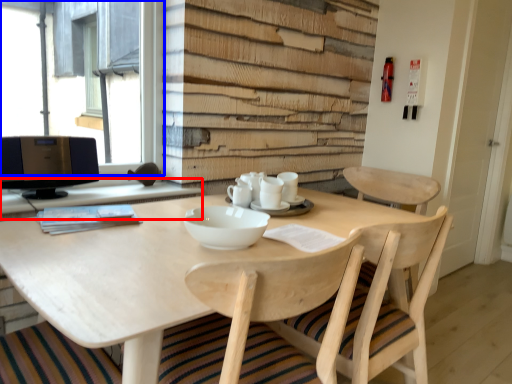
Question: Which point is further to the camera, computer desk (highlighted by a red box) or window (highlighted by a blue box)?

Choices:
 (A) computer desk
 (B) window

Answer: (B)